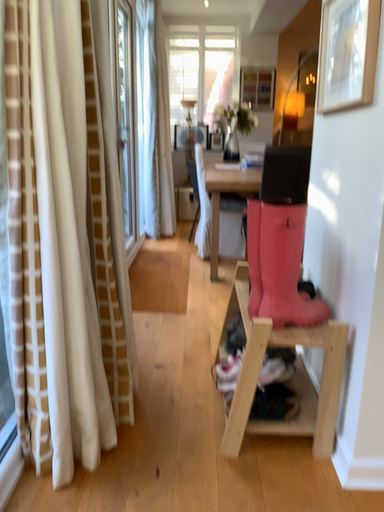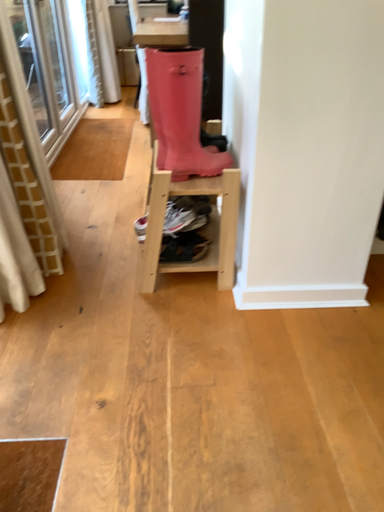
Question: Which way did the camera rotate in the video?

Choices:
 (A) rotated upward
 (B) rotated downward

Answer: (B)